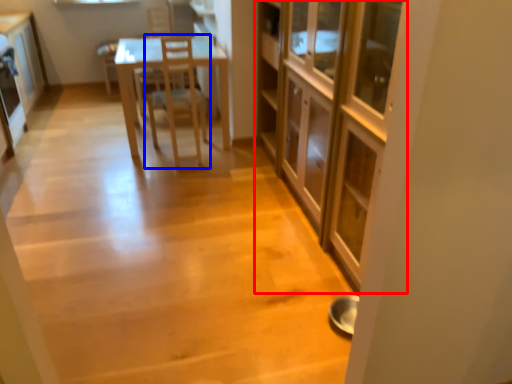
Question: Which object appears closest to the camera in this image, cabinetry (highlighted by a red box) or chair (highlighted by a blue box)?

Choices:
 (A) cabinetry
 (B) chair

Answer: (A)